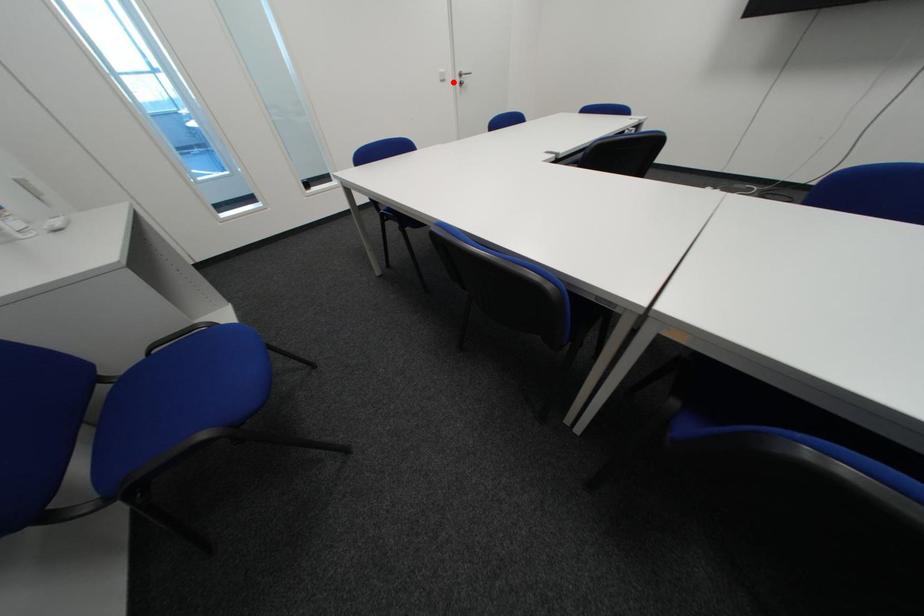
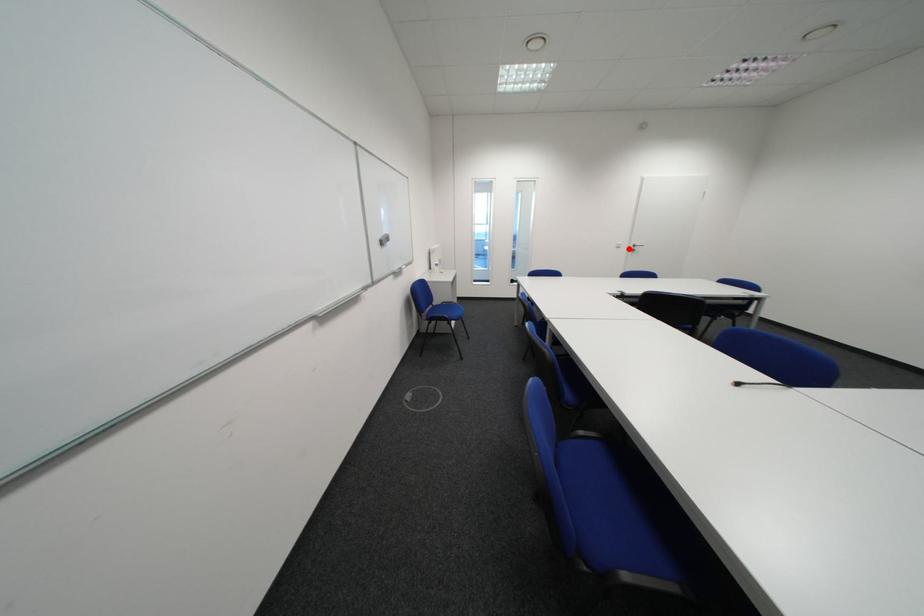
I am providing you with two images of the same scene from different viewpoints. A red point is marked on the first image and another point is marked on the second image. Are the points marked in image1 and image2 representing the same 3D position?

Yes